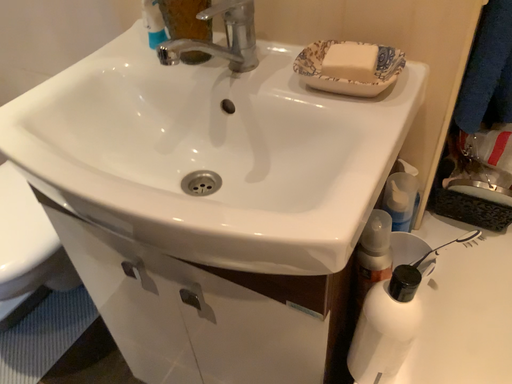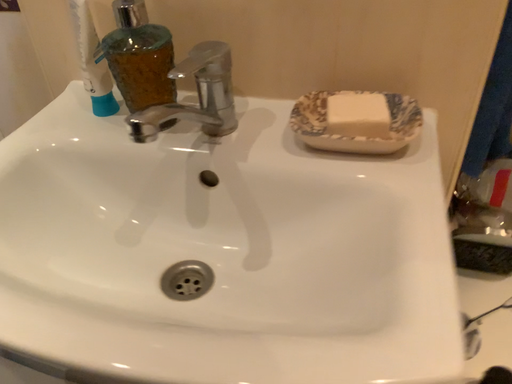
Question: Which way did the camera rotate in the video?

Choices:
 (A) rotated right
 (B) rotated left

Answer: (A)